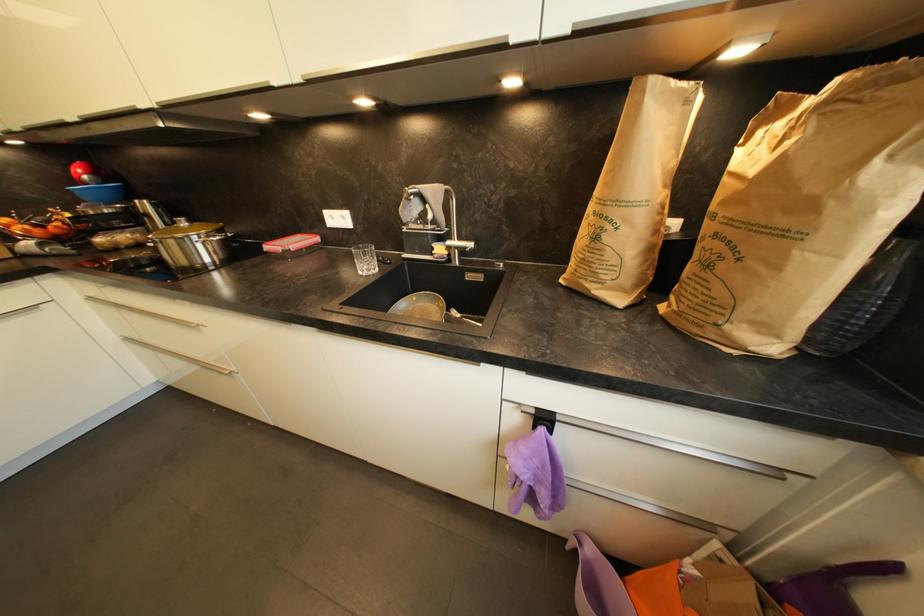
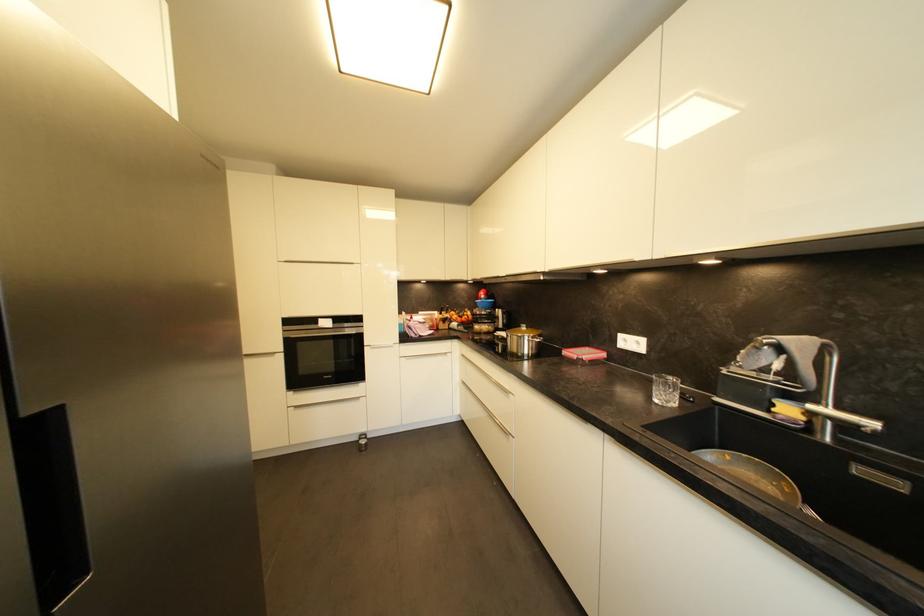
The point at (193, 224) is marked in the first image. Where is the corresponding point in the second image?

(531, 330)